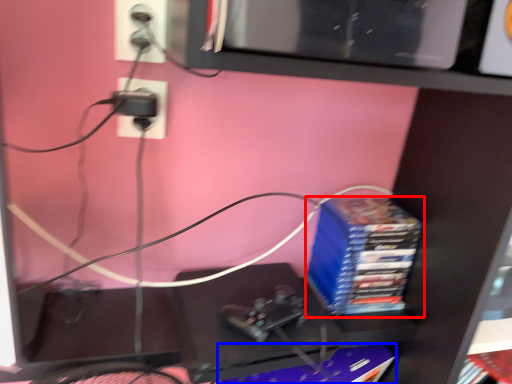
Question: Among these objects, which one is nearest to the camera, paperback book (highlighted by a red box) or paperback book (highlighted by a blue box)?

Choices:
 (A) paperback book
 (B) paperback book

Answer: (B)